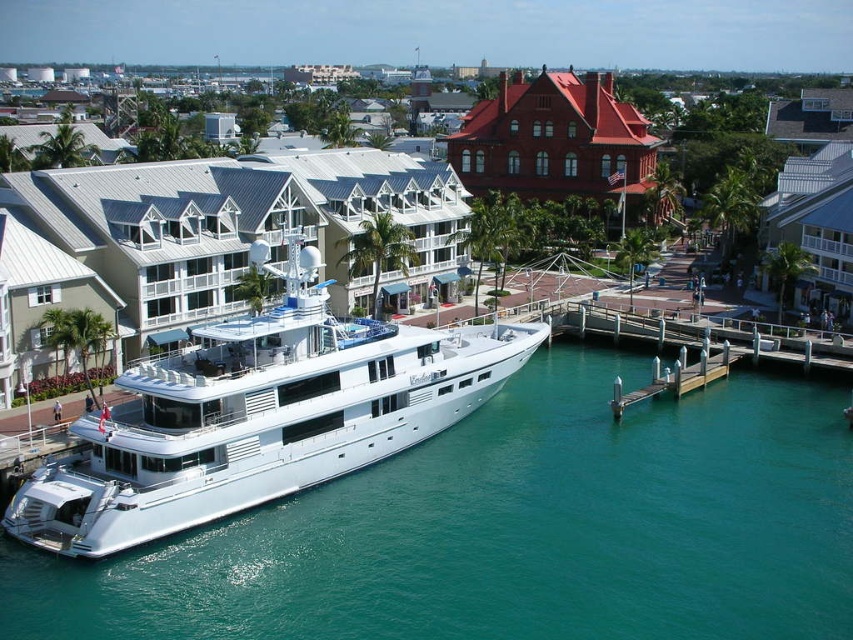
Does clear blue water at lower left appear on the right side of white glossy cruise ship at center?

Correct, you'll find clear blue water at lower left to the right of white glossy cruise ship at center.

This screenshot has width=853, height=640. What do you see at coordinates (514, 529) in the screenshot? I see `clear blue water at lower left` at bounding box center [514, 529].

Is point (537, 452) positioned behind point (381, 384)?

Yes, point (537, 452) is behind point (381, 384).

The height and width of the screenshot is (640, 853). In order to click on clear blue water at lower left in this screenshot , I will do `click(514, 529)`.

Can you confirm if white glossy cruise ship at center is positioned to the right of wooden dock at lower right?

In fact, white glossy cruise ship at center is to the left of wooden dock at lower right.

Who is positioned more to the left, white glossy cruise ship at center or wooden dock at lower right?

Positioned to the left is white glossy cruise ship at center.

Is point (273, 422) farther from camera compared to point (635, 401)?

No, (273, 422) is closer to viewer.

Where is `white glossy cruise ship at center`? This screenshot has height=640, width=853. white glossy cruise ship at center is located at coordinates (259, 416).

In order to click on white glossy building at center in this screenshot , I will do `click(242, 228)`.

Is white glossy building at center smaller than red brick building at upper center?

Indeed, white glossy building at center has a smaller size compared to red brick building at upper center.

Identify the location of white glossy building at center. This screenshot has height=640, width=853. (242, 228).